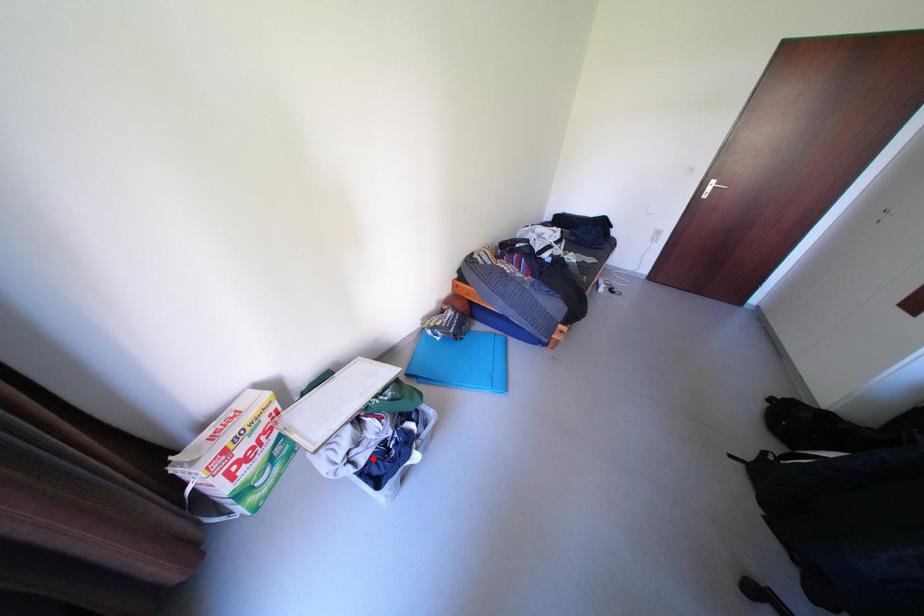
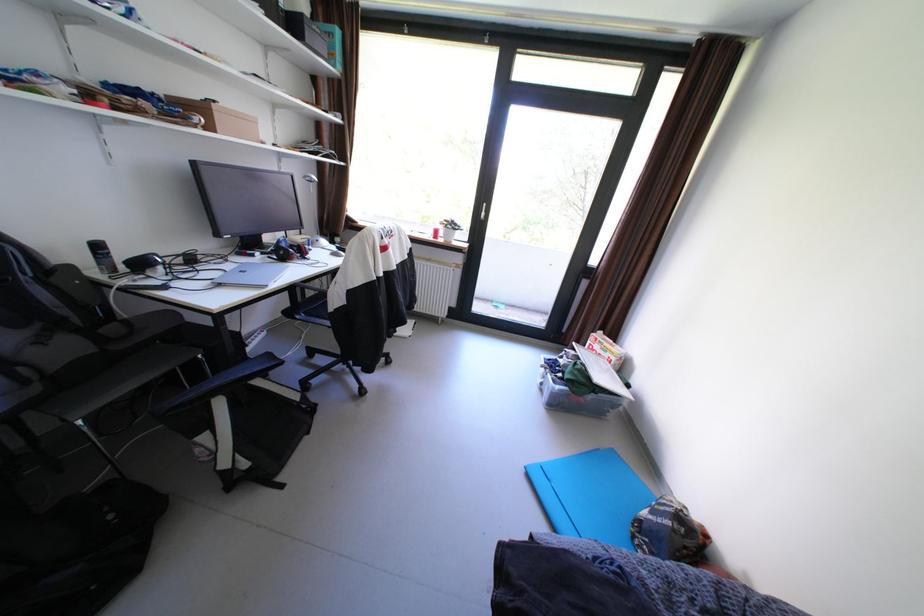
Where in the second image is the point corresponding to the highlighted location from the first image?

(572, 361)